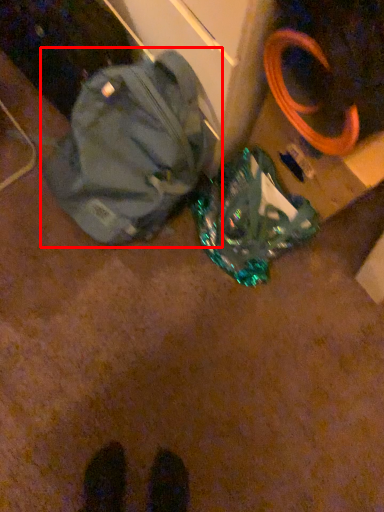
Question: Considering the relative positions of backpack (annotated by the red box) and luggage and bags in the image provided, where is backpack (annotated by the red box) located with respect to the staircase?

Choices:
 (A) left
 (B) right

Answer: (A)